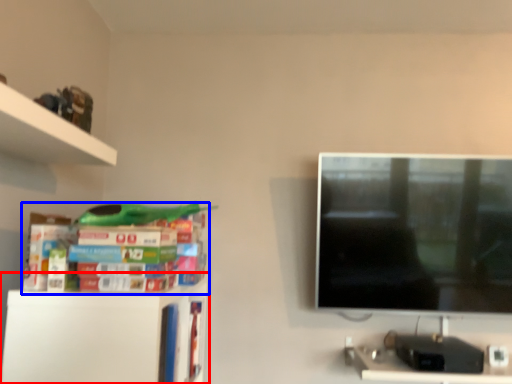
Question: Which object appears farthest to the camera in this image, shelf (highlighted by a red box) or book (highlighted by a blue box)?

Choices:
 (A) shelf
 (B) book

Answer: (A)